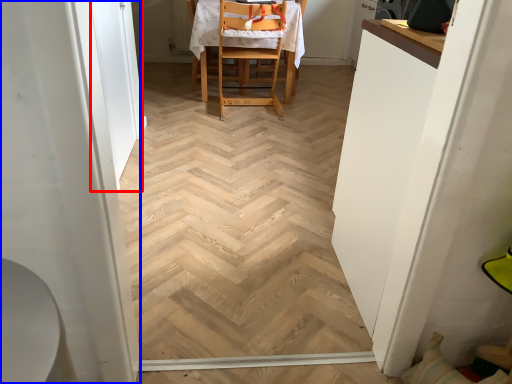
Question: Which point is further to the camera, screen door (highlighted by a red box) or screen door (highlighted by a blue box)?

Choices:
 (A) screen door
 (B) screen door

Answer: (A)